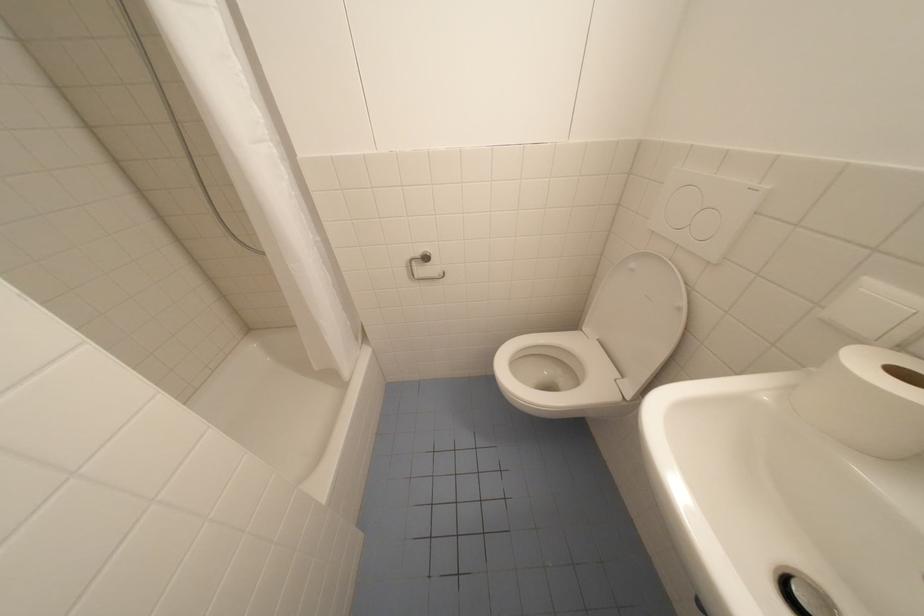
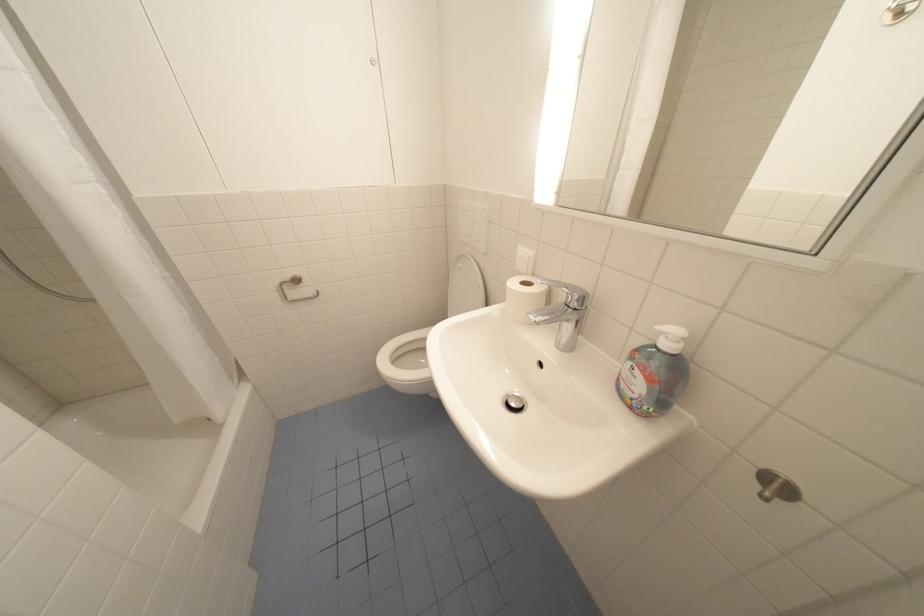
Find the pixel in the second image that matches the point at 686,246 in the first image.

(480, 248)